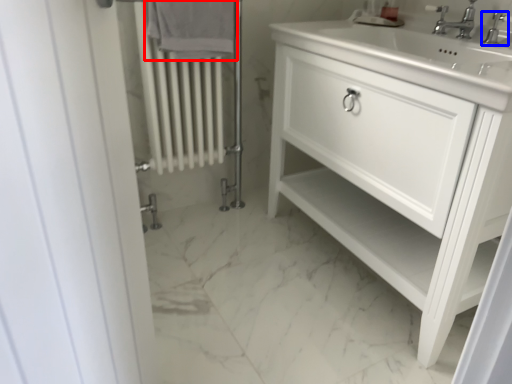
Question: Which object is closer to the camera taking this photo, bath towel (highlighted by a red box) or tap (highlighted by a blue box)?

Choices:
 (A) bath towel
 (B) tap

Answer: (B)